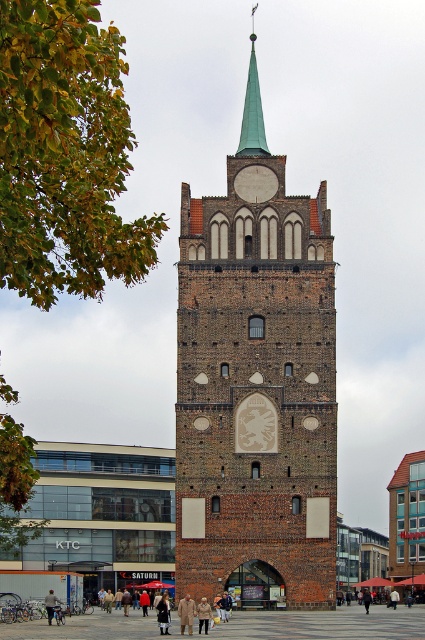
You are a visitor standing in the public square looking at the historic brick tower. You notice the green polished metal spire at upper center and the khaki cotton pants at center. Which object is taller?

The green polished metal spire at upper center is taller than the khaki cotton pants at center.

You are a medieval knight preparing for a tournament and see the dark brown leather coat at center and the brown leather jacket at lower center. Which one should you choose if you want a larger garment to wear?

The dark brown leather coat at center is wider than the brown leather jacket at lower center, so you should choose the dark brown leather coat at center for a larger garment.

You are a visitor standing at the base of the historic brick tower. You notice the green polished metal spire at upper center and the dark brown leather coat at center. If you want to touch both objects, which one would require you to climb the tower?

The green polished metal spire at upper center requires climbing the tower to reach, while the dark brown leather coat at center is at ground level and can be touched without climbing.